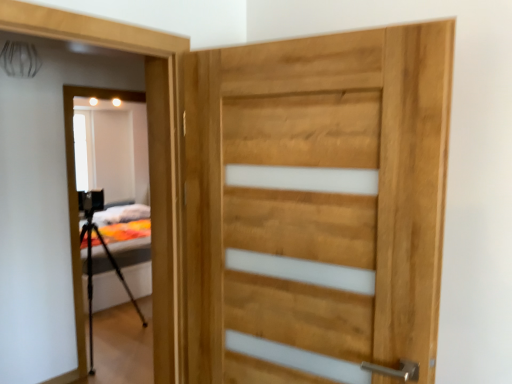
Question: From the image's perspective, is black matte tripod at left above natural wood door at center?

Choices:
 (A) no
 (B) yes

Answer: (A)

Question: Does black matte tripod at left come in front of natural wood door at center?

Choices:
 (A) no
 (B) yes

Answer: (A)

Question: From a real-world perspective, is black matte tripod at left below natural wood door at center?

Choices:
 (A) no
 (B) yes

Answer: (B)

Question: From the image's perspective, is black matte tripod at left under natural wood door at center?

Choices:
 (A) no
 (B) yes

Answer: (B)

Question: Would you consider black matte tripod at left to be distant from natural wood door at center?

Choices:
 (A) yes
 (B) no

Answer: (A)

Question: Is natural wood door at center inside black matte tripod at left?

Choices:
 (A) yes
 (B) no

Answer: (B)

Question: Is natural wood door at center positioned with its back to black matte tripod at left?

Choices:
 (A) yes
 (B) no

Answer: (B)

Question: From a real-world perspective, is natural wood door at center physically above black matte tripod at left?

Choices:
 (A) no
 (B) yes

Answer: (B)

Question: Is there a large distance between natural wood door at center and black matte tripod at left?

Choices:
 (A) no
 (B) yes

Answer: (B)

Question: From a real-world perspective, is natural wood door at center physically below black matte tripod at left?

Choices:
 (A) yes
 (B) no

Answer: (B)

Question: Can you confirm if natural wood door at center is positioned to the left of black matte tripod at left?

Choices:
 (A) yes
 (B) no

Answer: (B)

Question: Is natural wood door at center placed right next to black matte tripod at left?

Choices:
 (A) yes
 (B) no

Answer: (B)

Question: Is black matte tripod at left situated inside natural wood door at center or outside?

Choices:
 (A) outside
 (B) inside

Answer: (A)